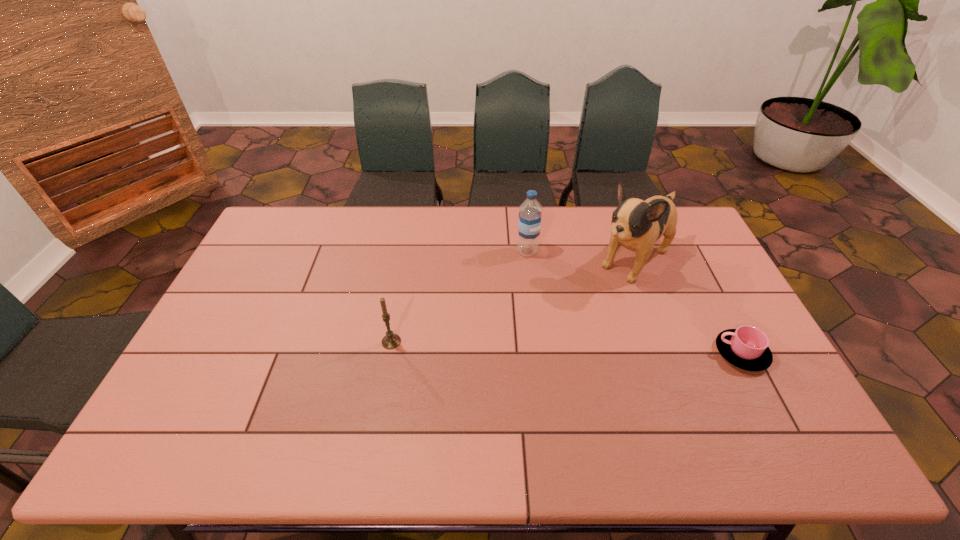
This screenshot has height=540, width=960. I want to click on the third tallest object, so click(x=390, y=341).

Where is `the leftmost object`? This screenshot has width=960, height=540. the leftmost object is located at coordinates (390, 341).

Identify the location of cup. This screenshot has width=960, height=540. (746, 347).

Find the location of a particular element. This screenshot has height=540, width=960. the tallest object is located at coordinates (636, 224).

I want to click on the second tallest object, so click(x=529, y=223).

Where is `the second object from left to right`? Image resolution: width=960 pixels, height=540 pixels. the second object from left to right is located at coordinates (529, 223).

Find the location of a particular element. vacant region located 0.090m on the right of the candle is located at coordinates (433, 342).

You are a GUI agent. You are given a task and a screenshot of the screen. Output one action in this format:
    pyautogui.click(x=<x>, y=<y>)
    Task: Click on the vacant space situated 0.050m on the side with the handle of the shortest object
    The image size is (960, 540).
    Given the screenshot: What is the action you would take?
    pyautogui.click(x=698, y=353)

You are a GUI agent. You are given a task and a screenshot of the screen. Output one action in this format:
    pyautogui.click(x=<x>, y=<y>)
    Task: Click on the vacant space situated on the side with the handle of the shortest object
    This screenshot has width=960, height=540.
    Given the screenshot: What is the action you would take?
    pyautogui.click(x=636, y=353)

Locate an element on the screen. This screenshot has width=960, height=540. vacant space located on the side with the handle of the shortest object is located at coordinates (684, 353).